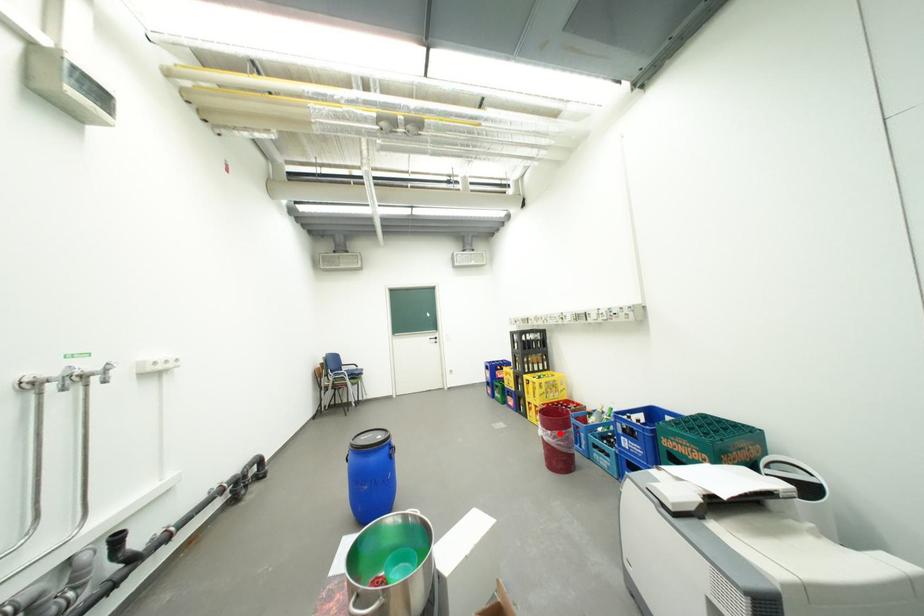
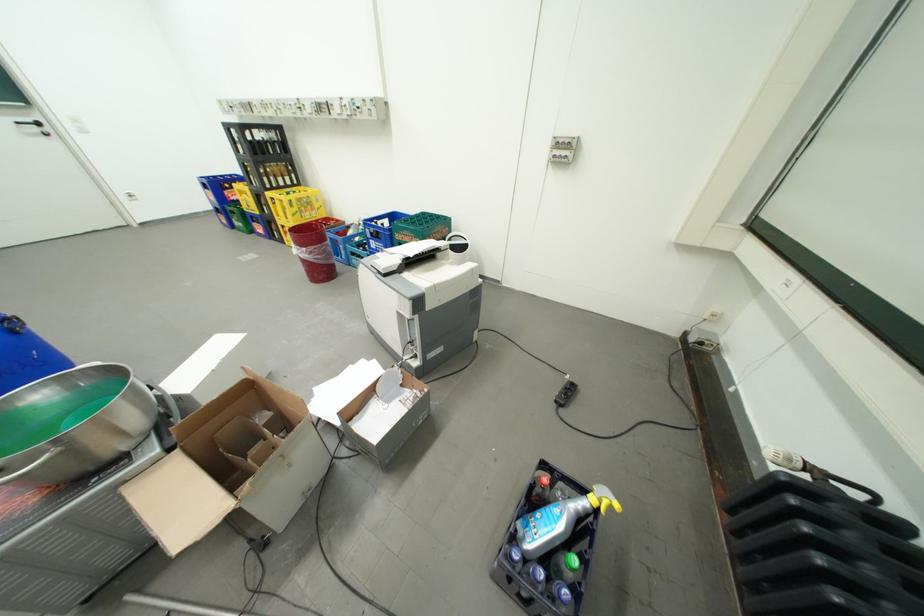
In the second image, find the point that corresponds to the highlighted location in the first image.

(314, 249)